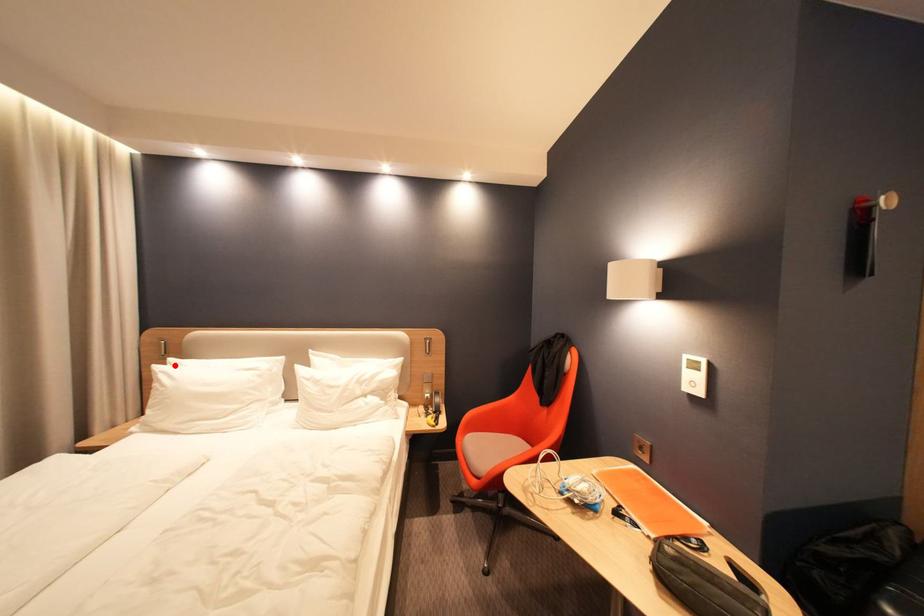
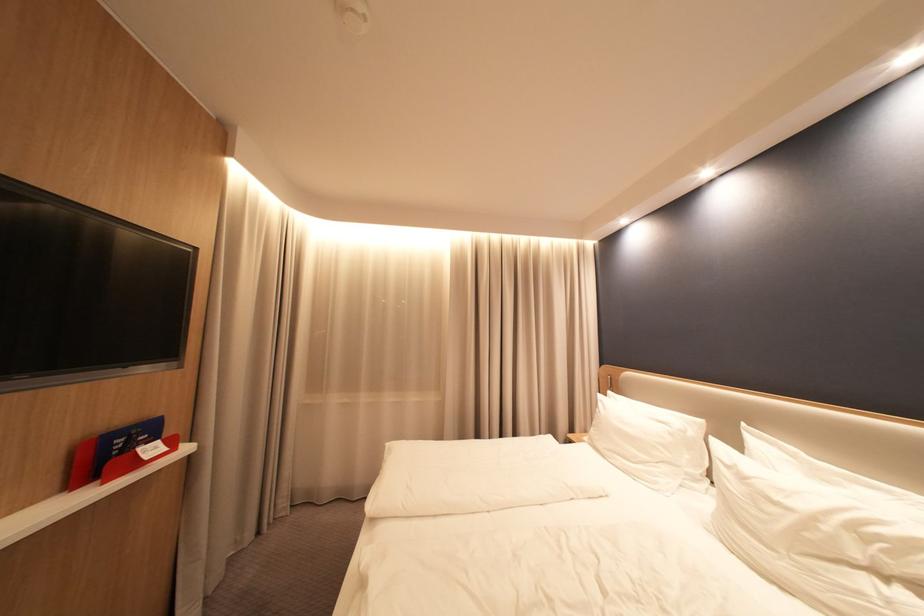
Question: I am providing you with two images of the same scene from different viewpoints. Given a red point in image1, look at the same physical point in image2. Is it:

Choices:
 (A) Closer to the viewpoint
 (B) Farther from the viewpoint

Answer: (B)